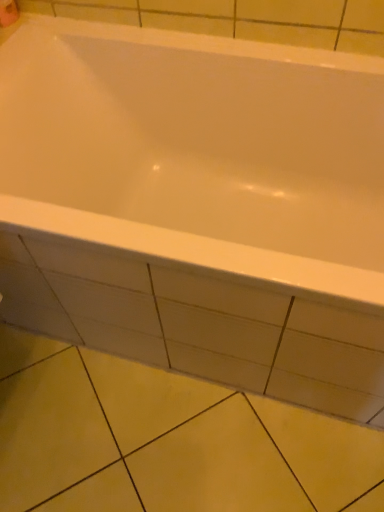
What do you see at coordinates (198, 152) in the screenshot? I see `white glossy bathtub at center` at bounding box center [198, 152].

I want to click on white paper at upper left, so click(x=8, y=12).

Which is behind, white paper at upper left or white glossy bathtub at center?

white paper at upper left is further away from the camera.

Considering the sizes of white paper at upper left and white glossy bathtub at center in the image, is white paper at upper left wider or thinner than white glossy bathtub at center?

white paper at upper left is thinner than white glossy bathtub at center.

Measure the distance from white paper at upper left to white glossy bathtub at center.

white paper at upper left and white glossy bathtub at center are 23.83 inches apart.

Is white paper at upper left at the left side of white glossy bathtub at center?

Yes, white paper at upper left is to the left of white glossy bathtub at center.

Is white glossy bathtub at center in front of or behind white paper at upper left in the image?

white glossy bathtub at center is in front of white paper at upper left.

Does white glossy bathtub at center have a larger size compared to white paper at upper left?

Indeed, white glossy bathtub at center has a larger size compared to white paper at upper left.

Which of these two, white glossy bathtub at center or white paper at upper left, is wider?

white glossy bathtub at center is wider.

Which is less distant, (130, 199) or (6, 11)?

Point (130, 199) is farther from the camera than point (6, 11).

Is point (192, 474) behind point (13, 8)?

No, (192, 474) is in front of (13, 8).

Which of these two, yellow matte tile at lower center or white paper at upper left, is thinner?

white paper at upper left is thinner.

Does yellow matte tile at lower center lie in front of white paper at upper left?

That is True.

Is yellow matte tile at lower center beside white paper at upper left?

yellow matte tile at lower center and white paper at upper left are not in contact.

From a real-world perspective, which object stands above the other?

white paper at upper left.

Does white paper at upper left appear on the right side of yellow matte tile at lower center?

No, white paper at upper left is not to the right of yellow matte tile at lower center.

Is white paper at upper left far away from yellow matte tile at lower center?

Yes, white paper at upper left and yellow matte tile at lower center are located far from each other.

Can you confirm if white glossy bathtub at center is shorter than yellow matte tile at lower center?

Incorrect, the height of white glossy bathtub at center does not fall short of that of yellow matte tile at lower center.

Considering the sizes of white glossy bathtub at center and yellow matte tile at lower center in the image, is white glossy bathtub at center wider or thinner than yellow matte tile at lower center?

white glossy bathtub at center is wider than yellow matte tile at lower center.

From the image's perspective, is white glossy bathtub at center located above yellow matte tile at lower center?

Yes, from the image's perspective, white glossy bathtub at center is over yellow matte tile at lower center.

Is white glossy bathtub at center at the left side of yellow matte tile at lower center?

No.

Consider the image. Which is farther, (199, 472) or (52, 153)?

The point (52, 153) is more distant.

From a real-world perspective, which object stands above the other?

From a 3D spatial view, white glossy bathtub at center is above.

Is yellow matte tile at lower center completely or partially outside of white glossy bathtub at center?

Yes.

Does yellow matte tile at lower center have a larger size compared to white glossy bathtub at center?

No, yellow matte tile at lower center is not bigger than white glossy bathtub at center.

Where is `bathtub below the white paper at upper left (from a real-world perspective)`? The height and width of the screenshot is (512, 384). bathtub below the white paper at upper left (from a real-world perspective) is located at coordinates click(198, 152).

You are a GUI agent. You are given a task and a screenshot of the screen. Output one action in this format:
    pyautogui.click(x=<x>, y=<y>)
    Task: Click on the bathtub located below the white paper at upper left (from the image's perspective)
    The width and height of the screenshot is (384, 512).
    Given the screenshot: What is the action you would take?
    pyautogui.click(x=198, y=152)

When comparing their distances from yellow matte tile at lower center, does white paper at upper left or white glossy bathtub at center seem further?

Among the two, white paper at upper left is located further to yellow matte tile at lower center.

From the image, which object appears to be farther from white paper at upper left, yellow matte tile at lower center or white glossy bathtub at center?

yellow matte tile at lower center is positioned further to the anchor white paper at upper left.

When comparing their distances from white paper at upper left, does white glossy bathtub at center or yellow matte tile at lower center seem closer?

white glossy bathtub at center is closer to white paper at upper left.

Considering their positions, is white glossy bathtub at center positioned closer to yellow matte tile at lower center than white paper at upper left?

white glossy bathtub at center.

Looking at the image, which one is located further to white glossy bathtub at center, white paper at upper left or yellow matte tile at lower center?

white paper at upper left lies further to white glossy bathtub at center than the other object.

Considering their positions, is yellow matte tile at lower center positioned closer to white glossy bathtub at center than white paper at upper left?

yellow matte tile at lower center is positioned closer to the anchor white glossy bathtub at center.

Identify the location of bathtub between white paper at upper left and yellow matte tile at lower center from top to bottom. (198, 152).